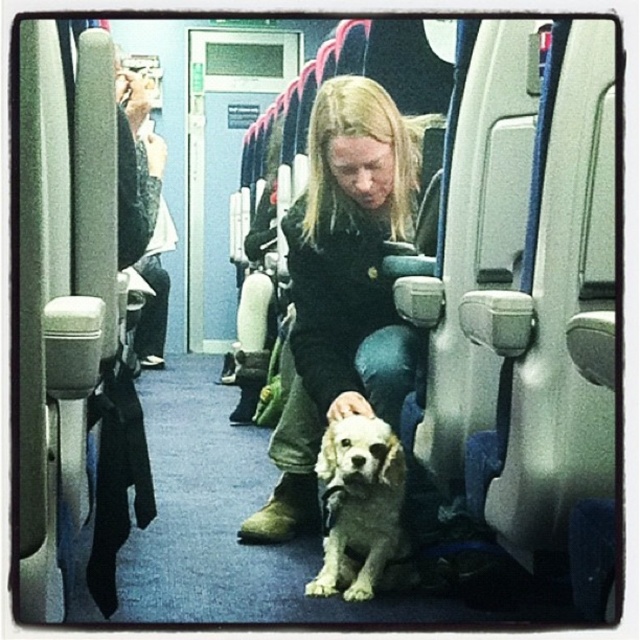
The width and height of the screenshot is (640, 640). What do you see at coordinates (342, 288) in the screenshot? I see `matte black jacket at center` at bounding box center [342, 288].

Is matte black jacket at center below white fur dog at center?

Actually, matte black jacket at center is above white fur dog at center.

Who is more distant from viewer, [353,323] or [372,563]?

Point [353,323]

Locate an element on the screen. matte black jacket at center is located at coordinates (342, 288).